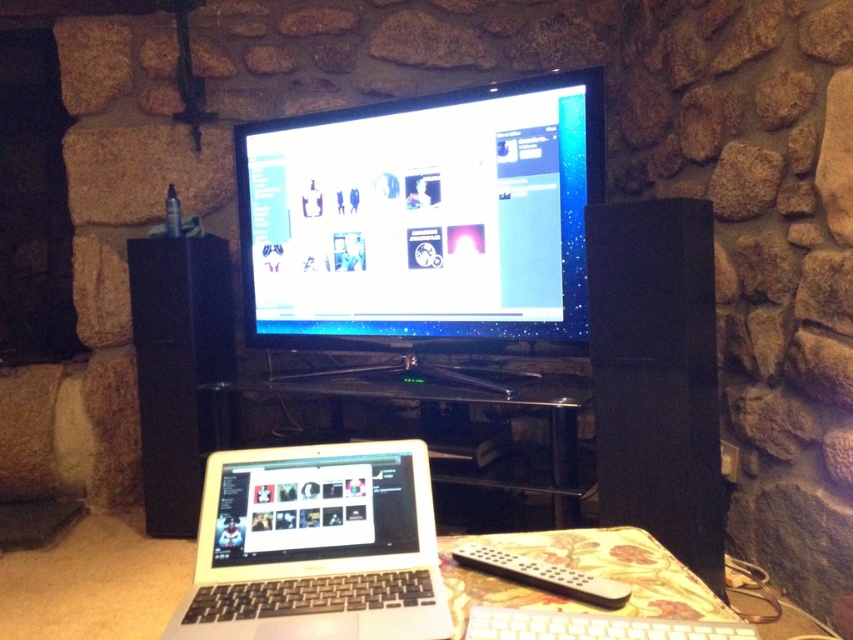
Question: Is matte black monitor at center in front of white plastic keyboard at lower center?

Choices:
 (A) no
 (B) yes

Answer: (A)

Question: Estimate the real-world distances between objects in this image. Which object is closer to the white plastic keyboard at lower center?

Choices:
 (A) black glass entertainment center at center
 (B) silver/black plastic laptop at lower center

Answer: (B)

Question: Which point appears farthest from the camera in this image?

Choices:
 (A) (531, 412)
 (B) (386, 477)
 (C) (488, 636)

Answer: (A)

Question: Is the position of silver/black plastic laptop at lower center more distant than that of white plastic keyboard at lower center?

Choices:
 (A) yes
 (B) no

Answer: (A)

Question: Which object appears closest to the camera in this image?

Choices:
 (A) silver/black plastic laptop at lower center
 (B) white plastic keyboard at lower center

Answer: (B)

Question: Can you confirm if silver/black plastic laptop at lower center is thinner than black glass entertainment center at center?

Choices:
 (A) no
 (B) yes

Answer: (B)